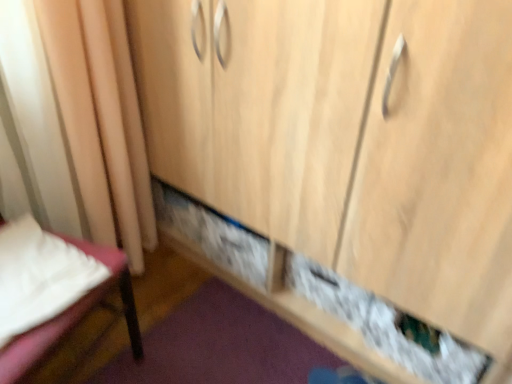
At what (x,y) coordinates should I click in order to perform the action: click on free space to the right of beige fabric curtain at left. Please return your answer as a coordinate pair (x, y). This screenshot has width=512, height=384. Looking at the image, I should click on (194, 305).